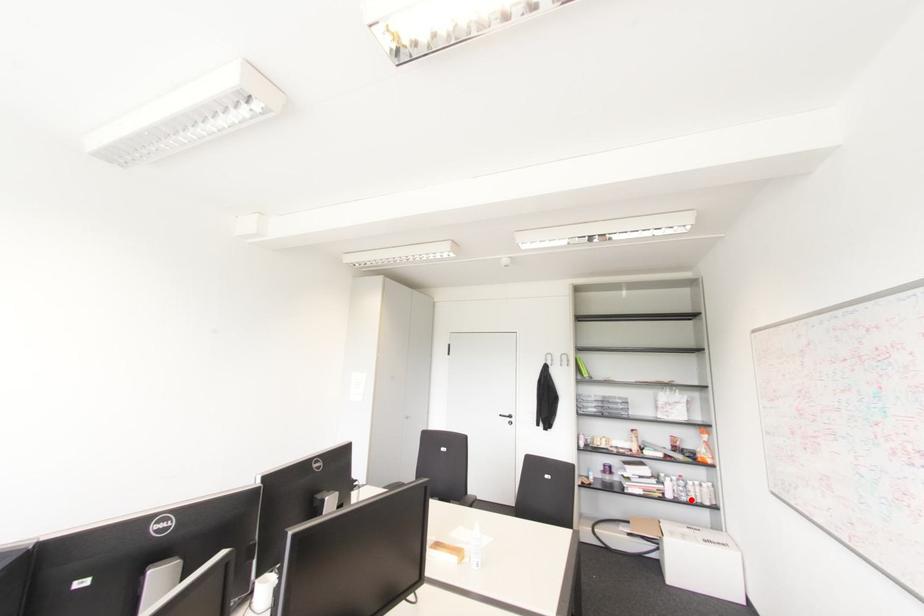
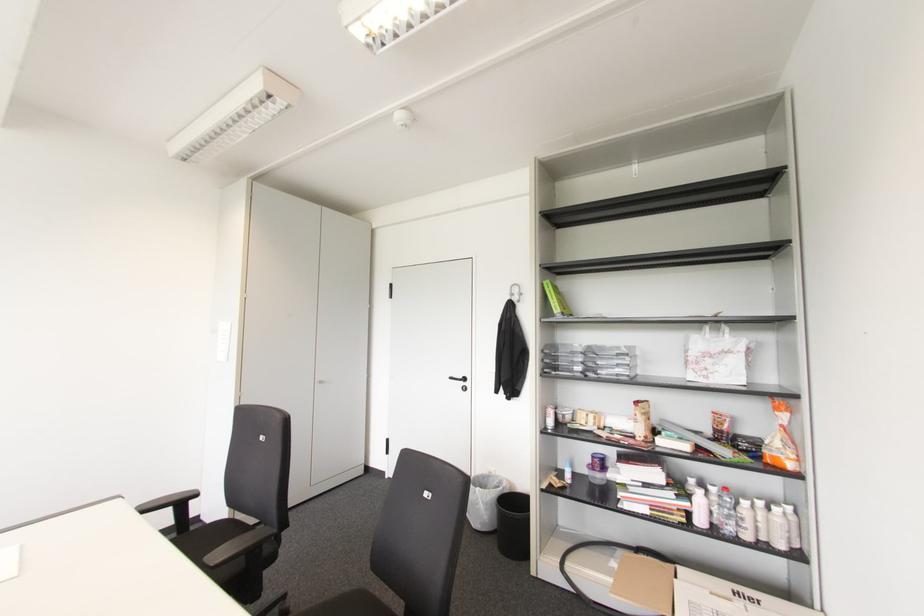
Locate, in the second image, the point that corresponds to the highlighted location in the first image.

(747, 536)